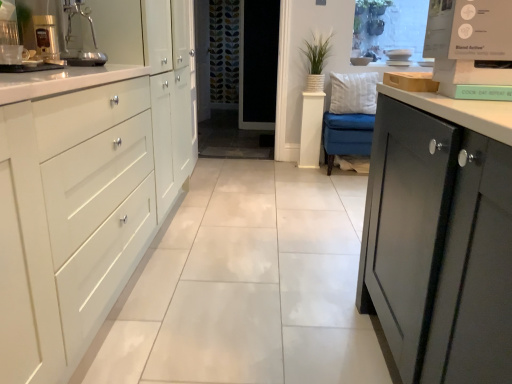
Question: Is white glossy cabinet at left completely or partially outside of transparent glass screen door at center?

Choices:
 (A) yes
 (B) no

Answer: (A)

Question: Is white glossy cabinet at left shorter than transparent glass screen door at center?

Choices:
 (A) no
 (B) yes

Answer: (B)

Question: From a real-world perspective, is white glossy cabinet at left on transparent glass screen door at center?

Choices:
 (A) no
 (B) yes

Answer: (A)

Question: Is transparent glass screen door at center at the back of white glossy cabinet at left?

Choices:
 (A) no
 (B) yes

Answer: (A)

Question: Is white glossy cabinet at left touching transparent glass screen door at center?

Choices:
 (A) yes
 (B) no

Answer: (B)

Question: Considering their positions, is metallic silver coffee machine at upper left located in front of or behind transparent glass screen door at center?

Choices:
 (A) behind
 (B) front

Answer: (B)

Question: Looking at the image, does metallic silver coffee machine at upper left seem bigger or smaller compared to transparent glass screen door at center?

Choices:
 (A) big
 (B) small

Answer: (B)

Question: From a real-world perspective, is metallic silver coffee machine at upper left positioned above or below transparent glass screen door at center?

Choices:
 (A) above
 (B) below

Answer: (A)

Question: Considering the positions of point (40, 41) and point (229, 9), is point (40, 41) closer or farther from the camera than point (229, 9)?

Choices:
 (A) closer
 (B) farther

Answer: (A)

Question: Is point (266, 16) positioned closer to the camera than point (41, 39)?

Choices:
 (A) closer
 (B) farther

Answer: (B)

Question: From the image's perspective, is transparent glass screen door at center above or below metallic silver coffee machine at upper left?

Choices:
 (A) below
 (B) above

Answer: (B)

Question: Considering the positions of transparent glass screen door at center and metallic silver coffee machine at upper left in the image, is transparent glass screen door at center wider or thinner than metallic silver coffee machine at upper left?

Choices:
 (A) thin
 (B) wide

Answer: (B)

Question: Is transparent glass screen door at center bigger or smaller than metallic silver coffee machine at upper left?

Choices:
 (A) small
 (B) big

Answer: (B)

Question: Based on their positions, is metallic silver coffee machine at upper left located to the left or right of white plush pillow at center?

Choices:
 (A) right
 (B) left

Answer: (B)

Question: Does point (49, 28) appear closer or farther from the camera than point (352, 87)?

Choices:
 (A) closer
 (B) farther

Answer: (A)